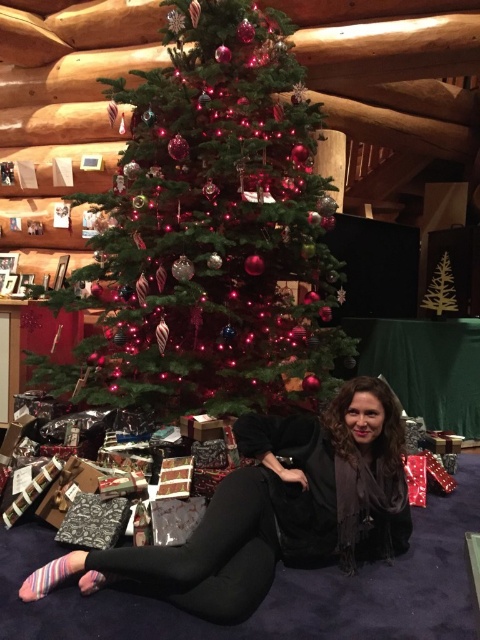
You are a guest at a holiday party and want to retrieve your black leggings at lower center. The shiny green christmas tree at center is blocking your path. Can you walk around the tree to reach it?

The black leggings at lower center is behind the shiny green christmas tree at center, so you can walk around the tree to access them.

You are a delivery person who just arrived with a package. You see the shiny green christmas tree at center and the black leggings at lower center. Which object is bigger?

The shiny green christmas tree at center is larger in size compared to the black leggings at lower center.